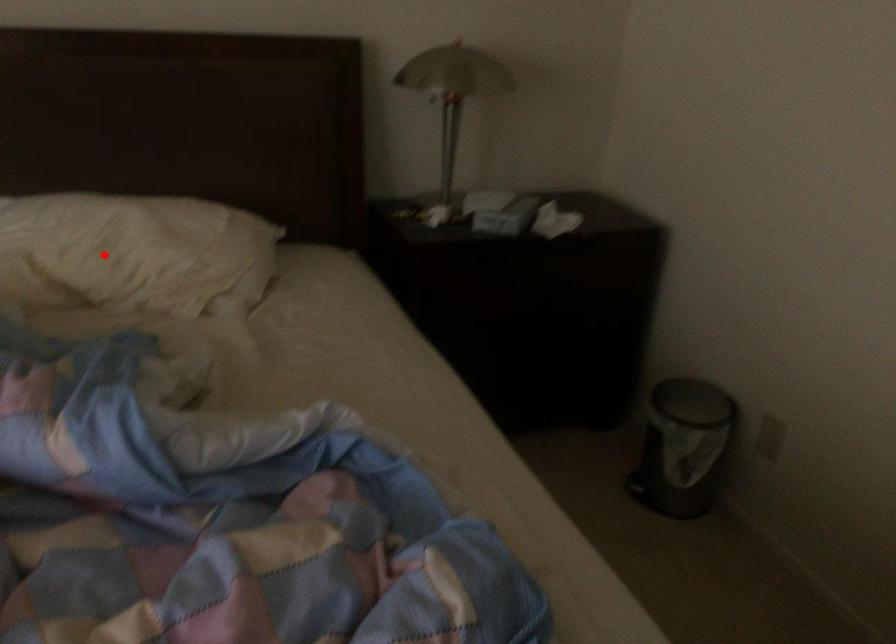
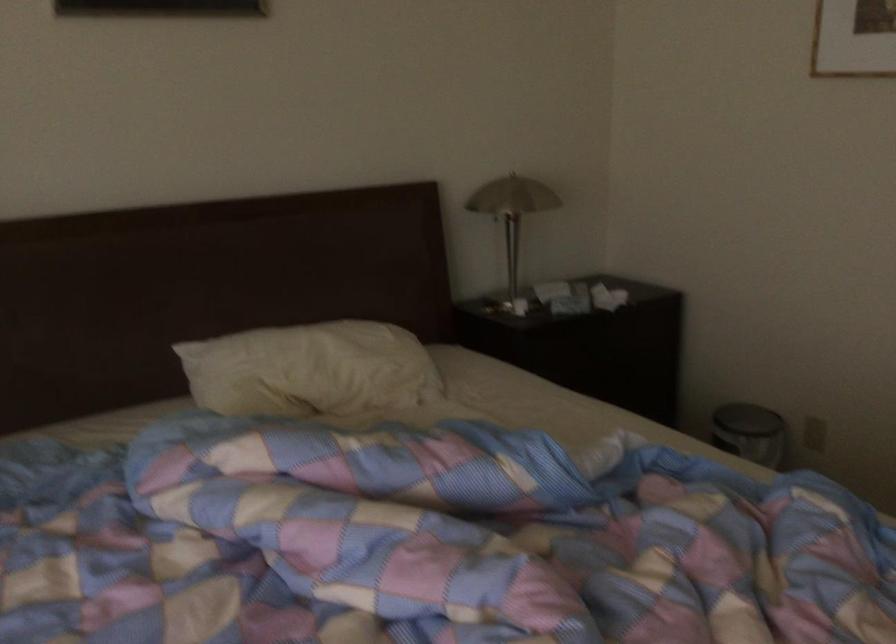
Find the pixel in the second image that matches the highlighted location in the first image.

(311, 370)